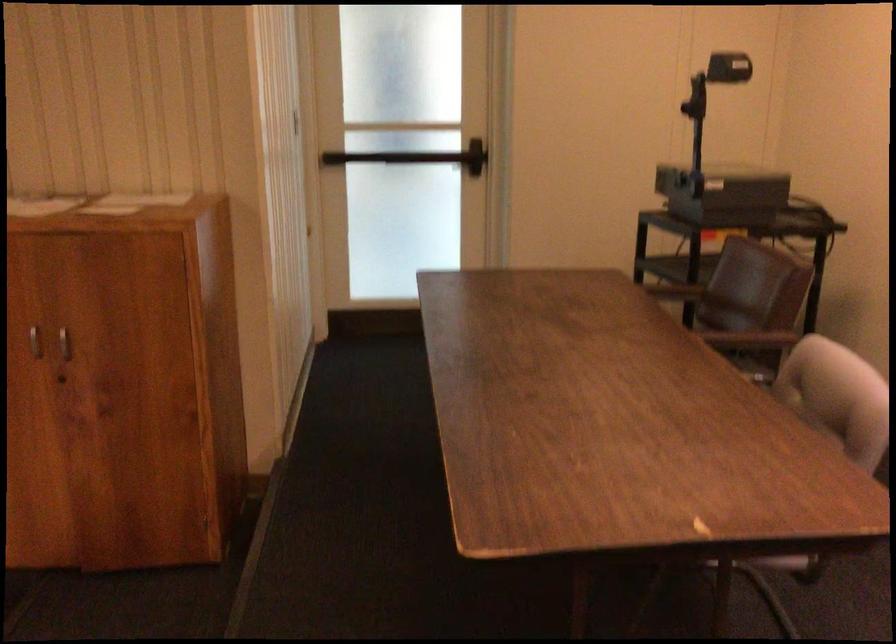
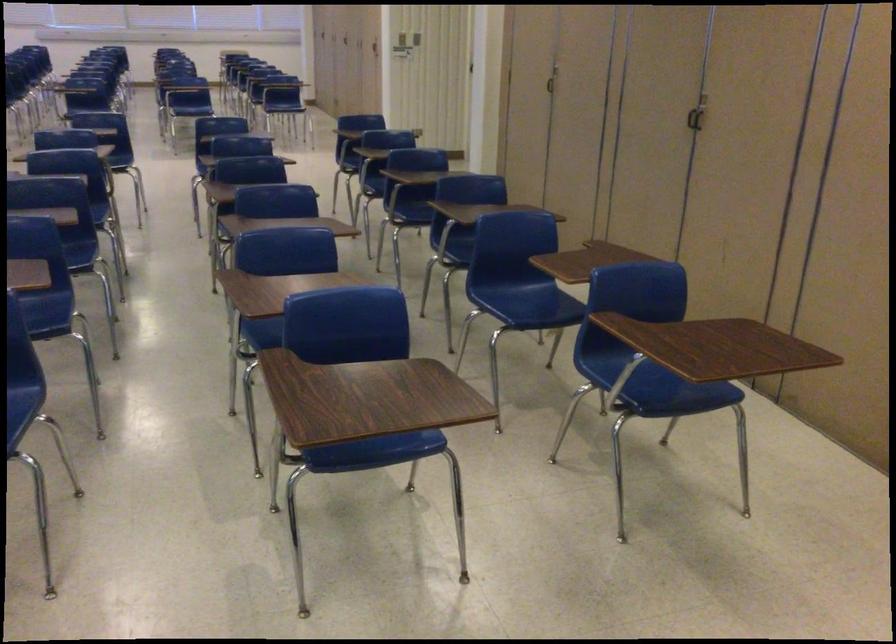
Question: The images are taken continuously from a first-person perspective. In which direction is your viewpoint rotating?

Choices:
 (A) Left
 (B) Right
 (C) Up
 (D) Down

Answer: (A)